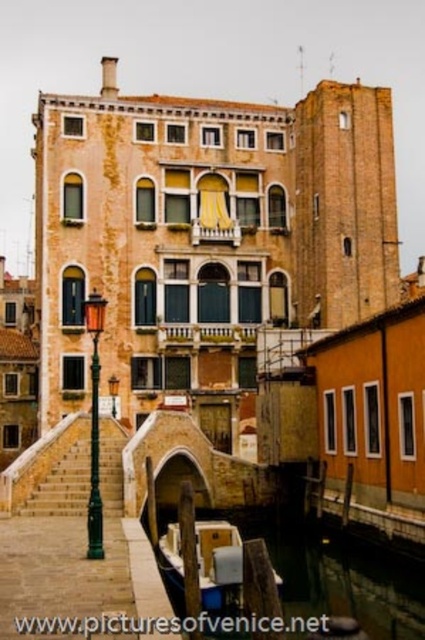
You are standing at the base of the bridge in Venice and see two points marked in the image. Which point, point (104,449) or point (87,328), is closer to you?

Point (104,449) is closer to you than point (87,328).

You are standing on the small bridge in Venice and notice a wooden boat at lower center and a green painted metal streetlamp at left. Which object is smaller in size?

The wooden boat at lower center is smaller in size compared to the green painted metal streetlamp at left.